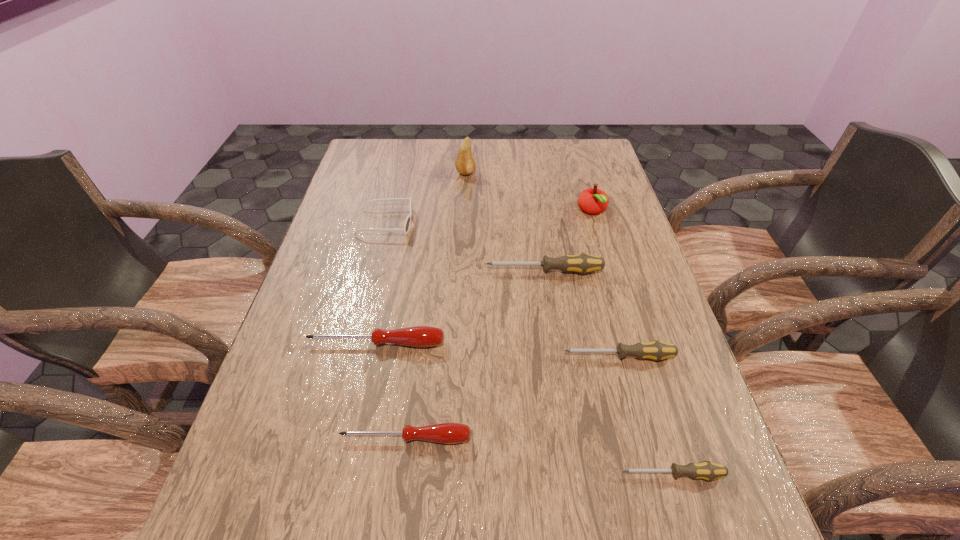
Identify the location of pear. tap(465, 163).

Find the location of `the tallest object`. the tallest object is located at coordinates (465, 163).

Identify the location of the seventh shortest object. The image size is (960, 540). (592, 200).

Identify the location of red apple. The width and height of the screenshot is (960, 540). 592,200.

Locate an element on the screen. The image size is (960, 540). the farthest screwdriver is located at coordinates (582, 263).

This screenshot has height=540, width=960. Identify the location of the fourth farthest object. (582, 263).

Where is `black sunglasses`? black sunglasses is located at coordinates tap(406, 228).

Image resolution: width=960 pixels, height=540 pixels. I want to click on the bigger red screwdriver, so click(418, 336).

At what (x,y) coordinates should I click in order to perform the action: click on the second nearest gray screwdriver. Please return your answer as a coordinate pair (x, y). Looking at the image, I should click on (655, 350).

Where is `the smaller red screwdriver`? This screenshot has width=960, height=540. the smaller red screwdriver is located at coordinates (446, 433).